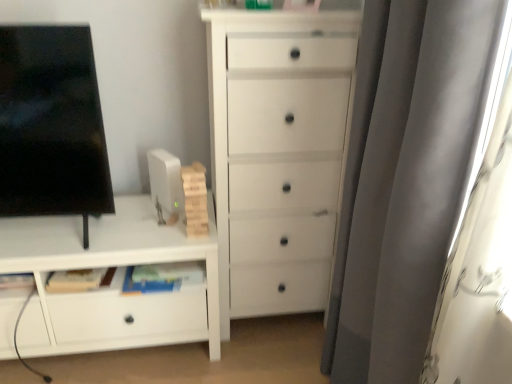
Where is `vacant location below black glossy screen at left (from a real-world perspective)`? vacant location below black glossy screen at left (from a real-world perspective) is located at coordinates (46, 233).